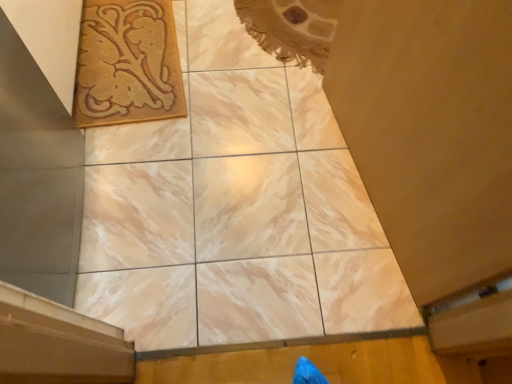
At what (x,y) coordinates should I click in order to perform the action: click on vacant region in front of beige woven rug at upper left. Please return your answer as a coordinate pair (x, y). This screenshot has height=384, width=512. Looking at the image, I should click on (130, 169).